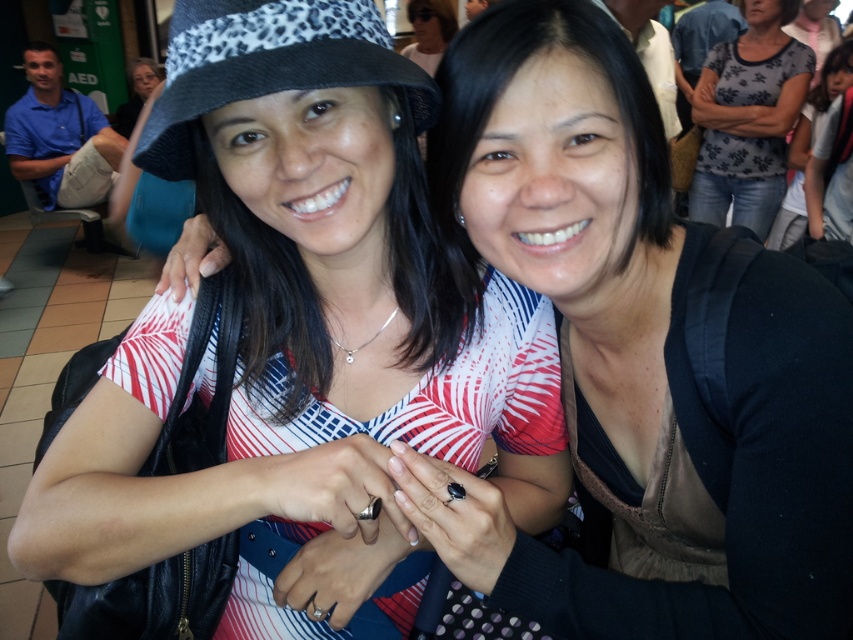
You are an artist trying to sketch the scene. You need to place the white matte hat at upper left in your drawing. What are the coordinates for its position?

The coordinates for the white matte hat at upper left are at point (302, 332).

You are an airport security officer checking the overhead compartments for safety. You notice two hats in the same compartment. The white matte hat at upper left and the black leopard print hat at upper left are both in the compartment. Can you determine if the hats are within the 6 inch size restriction for carryon luggage?

The white matte hat at upper left and black leopard print hat at upper left are 6.22 inches apart, which exceeds the 6 inch size restriction. Therefore, the hats do not comply with the carryon luggage requirements.